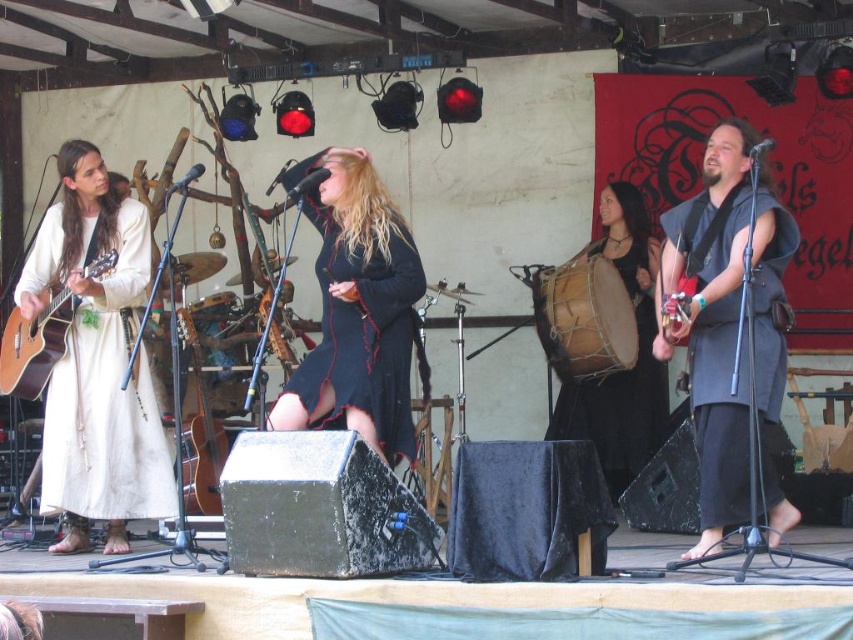
Identify the location of matte white gown at left. The image size is (853, 640). (96, 362).

Is matte white gown at left closer to the viewer compared to velvet black dress at center?

No.

Which is in front, point (91, 317) or point (366, 429)?

Positioned in front is point (366, 429).

The width and height of the screenshot is (853, 640). I want to click on matte white gown at left, so click(x=96, y=362).

How far apart are matte black vest at center and brown wooden guitar at center?

matte black vest at center is 3.20 meters away from brown wooden guitar at center.

Does point (753, 355) come behind point (196, 348)?

No, it is not.

I want to click on matte black vest at center, so click(x=730, y=330).

I want to click on matte black vest at center, so click(730, 330).

Can you confirm if matte black drum at center is positioned above matte brown acoustic guitar at left?

No, matte black drum at center is not above matte brown acoustic guitar at left.

Is point (622, 460) closer to camera compared to point (10, 376)?

No, (622, 460) is behind (10, 376).

Is point (627, 278) farther from viewer compared to point (22, 371)?

Yes, point (627, 278) is behind point (22, 371).

Where is `matte black drum at center`? This screenshot has height=640, width=853. matte black drum at center is located at coordinates (637, 353).